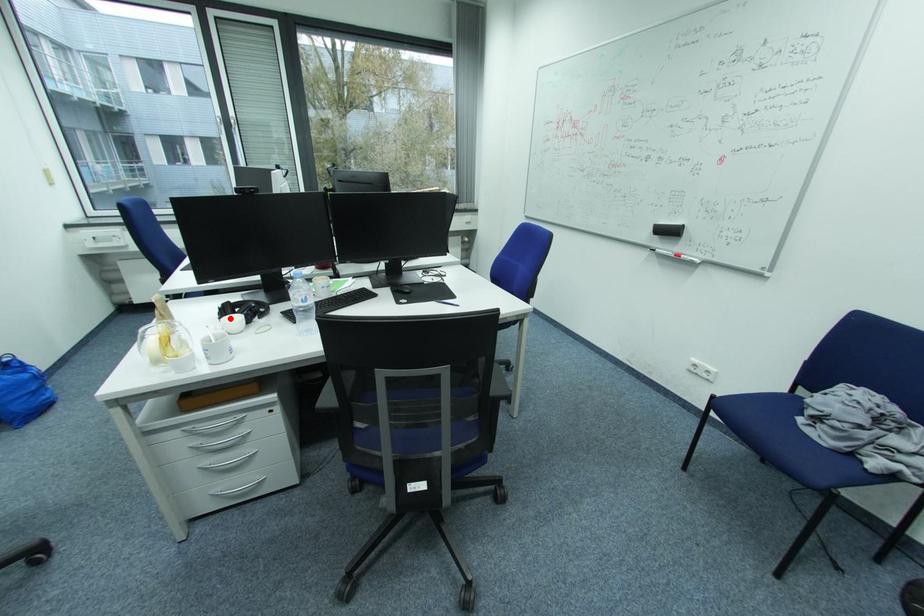
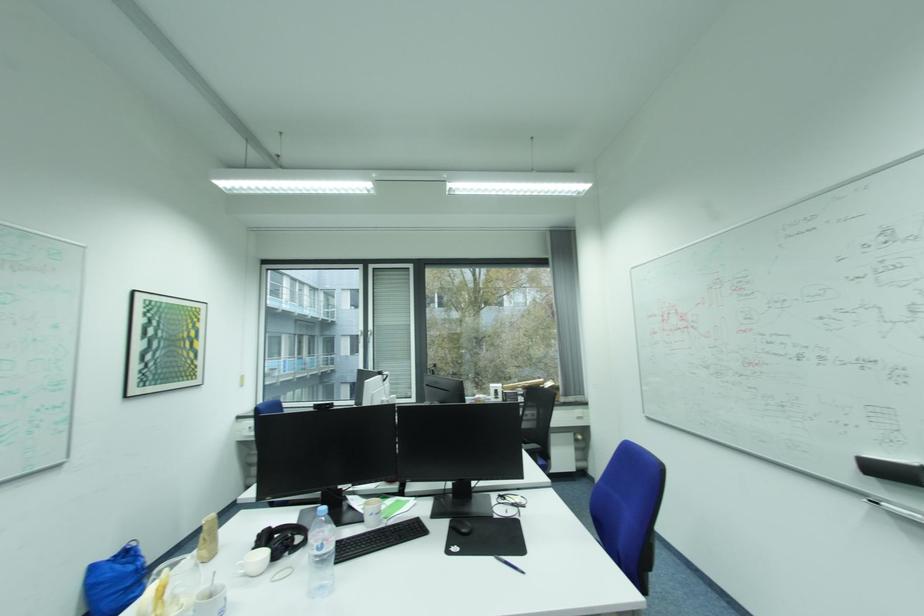
Find the pixel in the second image that matches the highlighted location in the first image.

(261, 551)